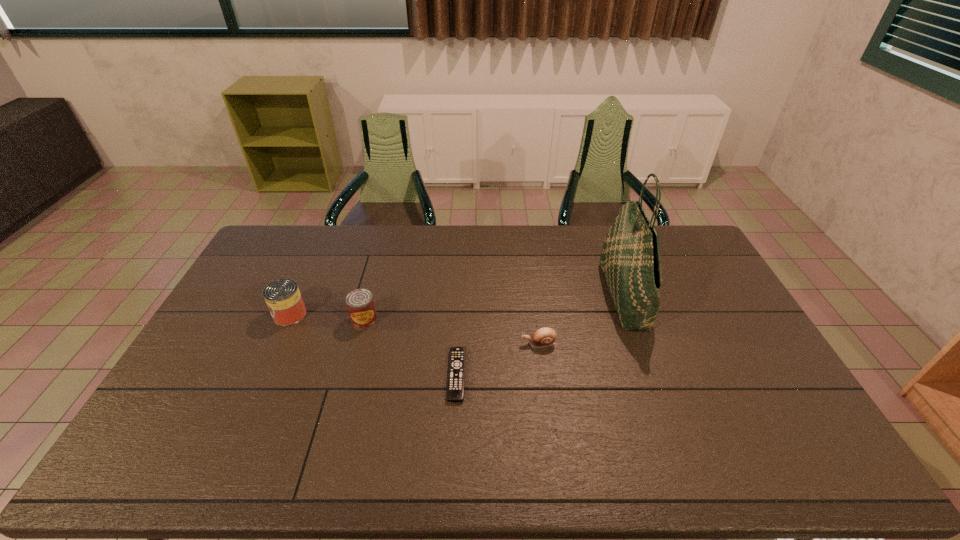
Identify the location of free space located 0.290m on the left of the right can. (262, 320).

What are the coordinates of `free space located on the front-facing side of the fourth object from left to right` in the screenshot? It's located at (485, 344).

Image resolution: width=960 pixels, height=540 pixels. In order to click on blank space located 0.130m on the front-facing side of the fourth object from left to right in this screenshot , I will do `click(479, 344)`.

You are a GUI agent. You are given a task and a screenshot of the screen. Output one action in this format:
    pyautogui.click(x=<x>, y=<y>)
    Task: Click on the free space located 0.190m on the front-facing side of the fourth object from left to right
    
    Given the screenshot: What is the action you would take?
    pyautogui.click(x=459, y=344)

Identify the location of vacant space located 0.310m on the left of the third object from left to right. The height and width of the screenshot is (540, 960). (341, 375).

Locate an element on the screen. The width and height of the screenshot is (960, 540). object positioned at the far edge is located at coordinates (630, 259).

In the image, there is a desktop. Identify the location of vacant space at the far edge. (370, 244).

Where is `vacant space at the near edge of the desktop`? vacant space at the near edge of the desktop is located at coordinates (556, 463).

Identify the location of vacant space at the left edge of the desktop. This screenshot has width=960, height=540. (230, 326).

Locate an element on the screen. The width and height of the screenshot is (960, 540). blank space at the right edge is located at coordinates (x=731, y=347).